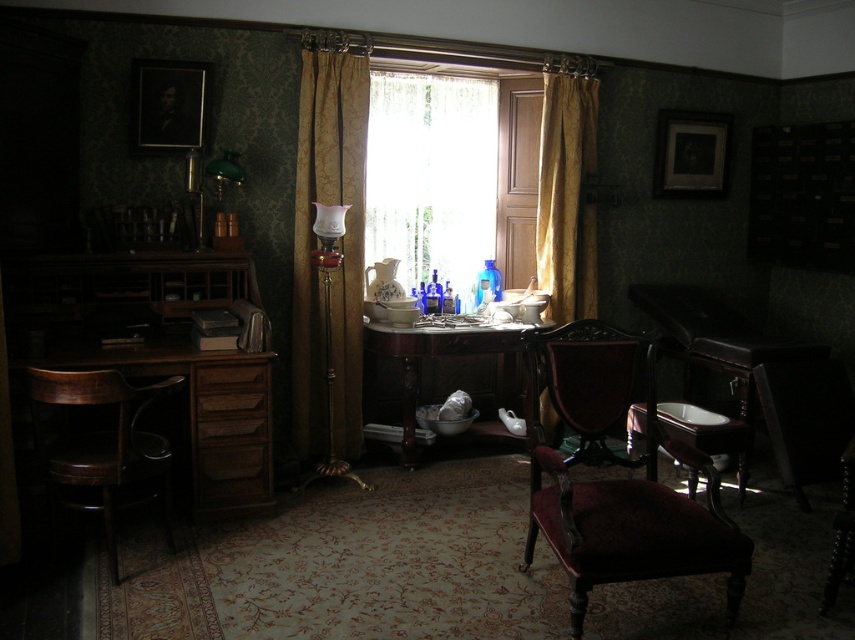
Question: Is gold velvet curtain at center below matte black toilet at lower right?

Choices:
 (A) yes
 (B) no

Answer: (B)

Question: Which object is farther from the camera taking this photo?

Choices:
 (A) wooden armchair at left
 (B) translucent fabric curtain at center
 (C) velvet burgundy armchair at center

Answer: (B)

Question: Does velvet burgundy armchair at center have a smaller size compared to wooden table at center?

Choices:
 (A) yes
 (B) no

Answer: (B)

Question: Estimate the real-world distances between objects in this image. Which object is closer to the matte black toilet at lower right?

Choices:
 (A) translucent fabric curtain at center
 (B) gold damask curtain at center
 (C) wooden table at center
 (D) wooden drawer at lower left

Answer: (C)

Question: Among these objects, which one is farthest from the camera?

Choices:
 (A) wooden armchair at left
 (B) translucent fabric curtain at center
 (C) matte black toilet at lower right
 (D) gold velvet curtain at center

Answer: (D)

Question: Does gold velvet curtain at center appear over wooden table at center?

Choices:
 (A) no
 (B) yes

Answer: (B)